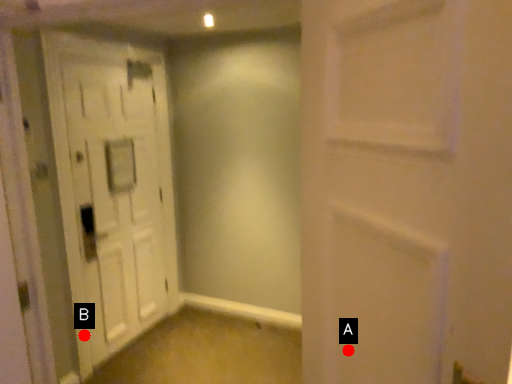
Question: Two points are circled on the image, labeled by A and B beside each circle. Which point is farther to the camera?

Choices:
 (A) A is further
 (B) B is further

Answer: (B)